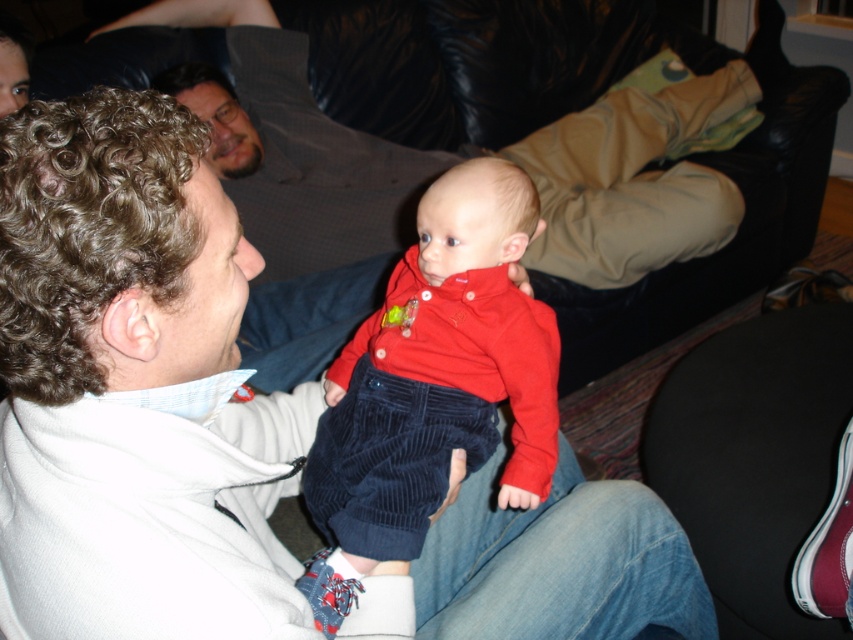
Question: Can you confirm if white fleece jacket at center is bigger than velvet corduroy pants at center?

Choices:
 (A) no
 (B) yes

Answer: (B)

Question: Based on their relative distances, which object is farther from the maroon suede shoe at lower right?

Choices:
 (A) white fleece jacket at center
 (B) velvet corduroy pants at center

Answer: (B)

Question: Among these objects, which one is farthest from the camera?

Choices:
 (A) maroon suede shoe at lower right
 (B) white fleece jacket at center

Answer: (A)

Question: Does velvet corduroy pants at center appear under maroon suede shoe at lower right?

Choices:
 (A) no
 (B) yes

Answer: (A)

Question: In this image, where is velvet corduroy pants at center located relative to maroon suede shoe at lower right?

Choices:
 (A) right
 (B) left

Answer: (B)

Question: Which is farther from the white fleece jacket at center?

Choices:
 (A) maroon suede shoe at lower right
 (B) velvet corduroy pants at center

Answer: (A)